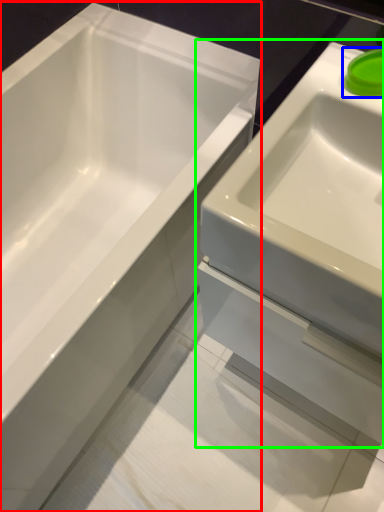
Question: Which is nearer to the bathtub (highlighted by a red box)? liquid (highlighted by a blue box) or sink (highlighted by a green box).

Choices:
 (A) liquid
 (B) sink

Answer: (B)